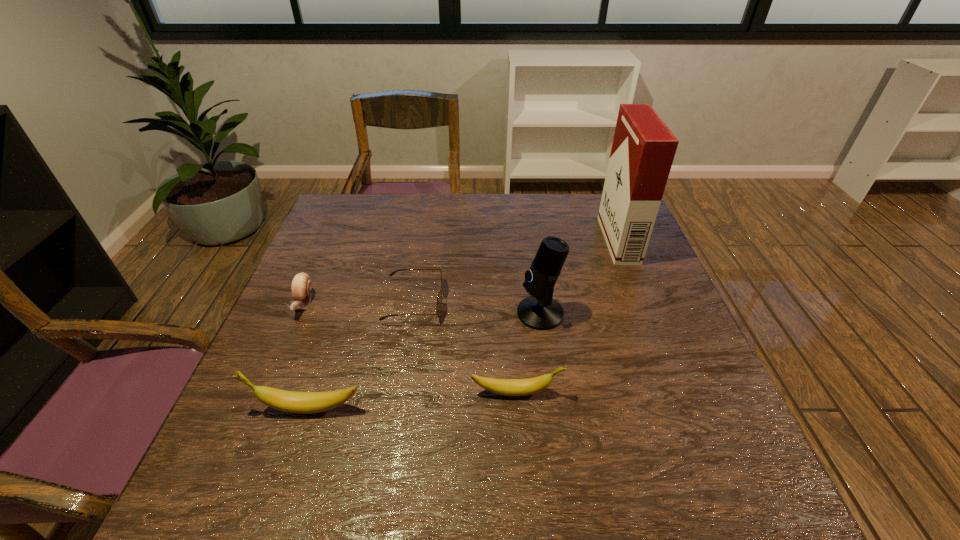
Find the location of a particular element. This screenshot has width=960, height=540. the taller banana is located at coordinates (288, 401).

Locate an element on the screen. The width and height of the screenshot is (960, 540). the left banana is located at coordinates (288, 401).

What are the coordinates of `the third shortest object` in the screenshot? It's located at (508, 387).

The width and height of the screenshot is (960, 540). What are the coordinates of `the right banana` in the screenshot? It's located at (508, 387).

You are a GUI agent. You are given a task and a screenshot of the screen. Output one action in this format:
    pyautogui.click(x=<x>, y=<y>)
    Task: Click on the rightmost object
    Image resolution: width=960 pixels, height=540 pixels.
    Given the screenshot: What is the action you would take?
    pyautogui.click(x=643, y=149)

Image resolution: width=960 pixels, height=540 pixels. Identify the location of the farthest object. (643, 149).

Where is `sunglasses`? This screenshot has width=960, height=540. sunglasses is located at coordinates (439, 299).

You are a GUI agent. You are given a task and a screenshot of the screen. Output one action in this format:
    pyautogui.click(x=<x>, y=<y>)
    Task: Click on the microphone
    
    Given the screenshot: What is the action you would take?
    pyautogui.click(x=540, y=311)

At what (x,y) coordinates should I click in order to perform the action: click on escargot. Please return your answer as a coordinate pair (x, y). The height and width of the screenshot is (540, 960). Looking at the image, I should click on (301, 287).

You are a GUI agent. You are given a task and a screenshot of the screen. Output one action in this format:
    pyautogui.click(x=<x>, y=<y>)
    Task: Click on the blank space located 0.290m at the stem of the shorter banana
    The image size is (960, 540).
    Given the screenshot: What is the action you would take?
    pyautogui.click(x=703, y=392)